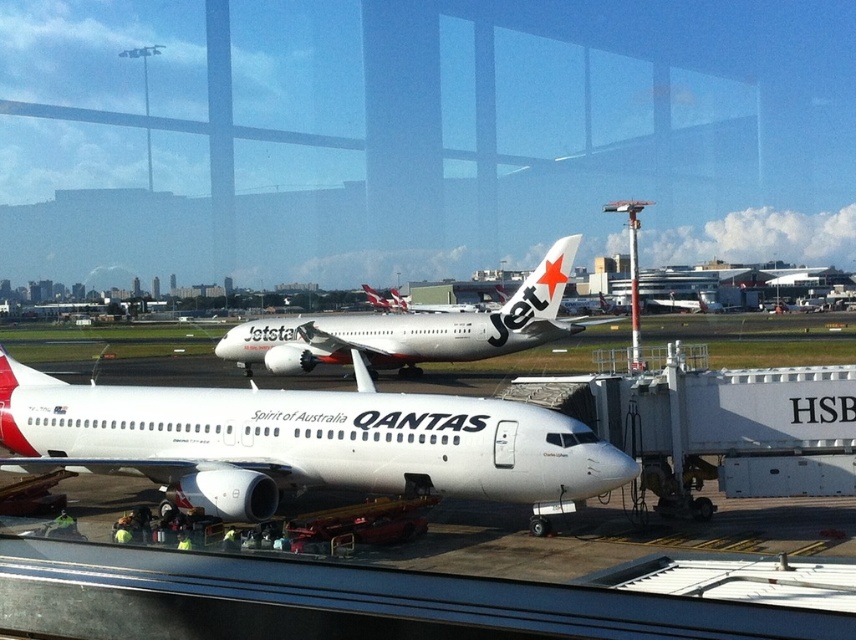
Question: Is white glossy airliner at center smaller than white glossy airplane at center?

Choices:
 (A) no
 (B) yes

Answer: (B)

Question: Where is white glossy airliner at center located in relation to white glossy airplane at center in the image?

Choices:
 (A) above
 (B) below

Answer: (B)

Question: Which of the following is the farthest from the observer?

Choices:
 (A) (522, 292)
 (B) (321, 468)

Answer: (A)

Question: Which point is farther to the camera?

Choices:
 (A) (479, 328)
 (B) (316, 477)

Answer: (A)

Question: Can you confirm if white glossy airliner at center is positioned below white glossy airplane at center?

Choices:
 (A) no
 (B) yes

Answer: (B)